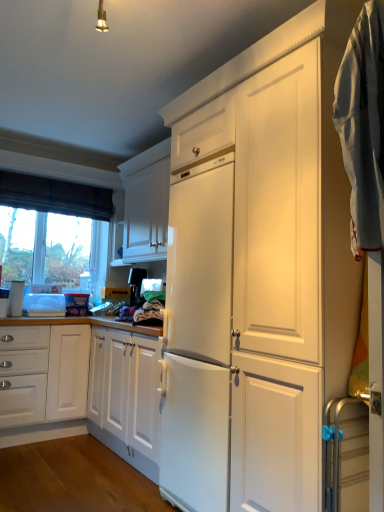
Question: From the image's perspective, is satin black coffee maker at center, acting as the second appliance starting from the bottom, located above or below white glossy cabinet at upper center?

Choices:
 (A) above
 (B) below

Answer: (B)

Question: Relative to white glossy cabinet at upper center, is satin black coffee maker at center, acting as the 2th appliance starting from the front, in front or behind?

Choices:
 (A) behind
 (B) front

Answer: (A)

Question: Which object is positioned farthest from the light blue cotton towel at right?

Choices:
 (A) white glossy cabinet at upper center
 (B) transparent glass window at left
 (C) satin black coffee maker at center, which ranks as the second appliance in right-to-left order
 (D) metallic silver towel rack at right, positioned as the first appliance in front-to-back order

Answer: (B)

Question: Which is farther from the light blue cotton towel at right?

Choices:
 (A) metallic silver towel rack at right, positioned as the first appliance in front-to-back order
 (B) transparent glass window at left
 (C) satin black coffee maker at center, acting as the second appliance starting from the bottom
 (D) white glossy cabinet at upper center

Answer: (B)